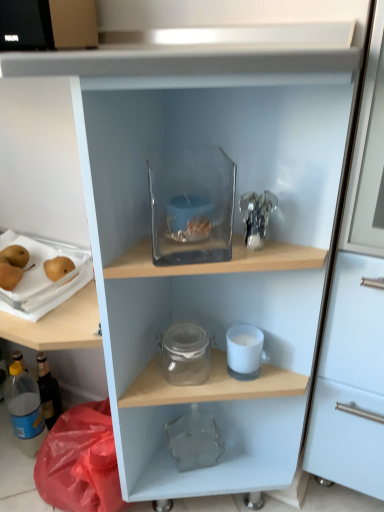
Question: Which direction should I rotate to look at transparent glass container at upper center, the 1th appliance in the top-to-bottom sequence, — up or down?

Choices:
 (A) down
 (B) up

Answer: (B)

Question: Is translucent plastic bottle at lower left looking in the opposite direction of translucent plastic tray with pears at left, acting as the 3th appliance starting from the right?

Choices:
 (A) no
 (B) yes

Answer: (A)

Question: Would you say translucent plastic bottle at lower left is a long distance from translucent plastic tray with pears at left, arranged as the 2th appliance when viewed from the top?

Choices:
 (A) no
 (B) yes

Answer: (A)

Question: Can you see translucent plastic bottle at lower left touching translucent plastic tray with pears at left, arranged as the second appliance when ordered from the bottom?

Choices:
 (A) yes
 (B) no

Answer: (B)

Question: Does translucent plastic bottle at lower left have a greater width compared to translucent plastic tray with pears at left, acting as the 3th appliance starting from the right?

Choices:
 (A) yes
 (B) no

Answer: (B)

Question: From the image's perspective, would you say translucent plastic bottle at lower left is shown under translucent plastic tray with pears at left, arranged as the 2th appliance when viewed from the top?

Choices:
 (A) no
 (B) yes

Answer: (B)

Question: Could you tell me if translucent plastic bottle at lower left is turned towards translucent plastic tray with pears at left, which ranks as the first appliance in left-to-right order?

Choices:
 (A) yes
 (B) no

Answer: (B)

Question: Is translucent plastic bottle at lower left smaller than transparent glass jar at middle?

Choices:
 (A) no
 (B) yes

Answer: (A)

Question: Considering the relative positions of translucent plastic bottle at lower left and transparent glass jar at middle in the image provided, is translucent plastic bottle at lower left behind transparent glass jar at middle?

Choices:
 (A) yes
 (B) no

Answer: (A)

Question: Is translucent plastic bottle at lower left placed right next to transparent glass jar at middle?

Choices:
 (A) no
 (B) yes

Answer: (A)

Question: Does translucent plastic bottle at lower left have a lesser height compared to transparent glass jar at middle?

Choices:
 (A) no
 (B) yes

Answer: (A)

Question: Is translucent plastic bottle at lower left closer to the viewer compared to transparent glass jar at middle?

Choices:
 (A) no
 (B) yes

Answer: (A)

Question: From a real-world perspective, is translucent plastic bottle at lower left physically below transparent glass jar at middle?

Choices:
 (A) no
 (B) yes

Answer: (B)

Question: Does smooth golden pears at left come in front of translucent plastic bottle at lower left?

Choices:
 (A) yes
 (B) no

Answer: (A)